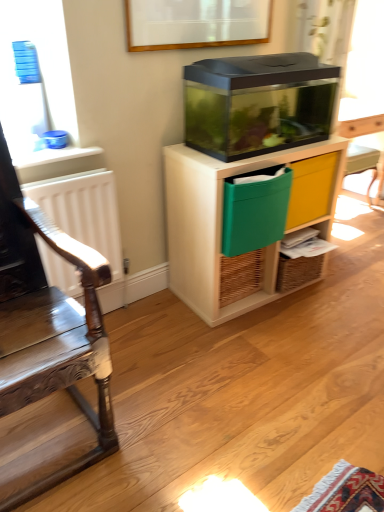
Locate an element on the screen. The image size is (384, 512). free space between transparent plastic cabinet at center and white matte radiator at left is located at coordinates (156, 316).